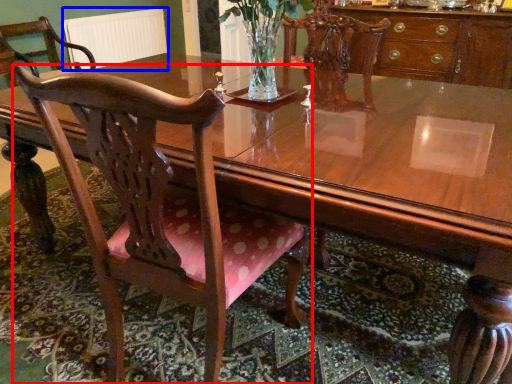
Question: Among these objects, which one is nearest to the camera, chair (highlighted by a red box) or radiator (highlighted by a blue box)?

Choices:
 (A) chair
 (B) radiator

Answer: (A)